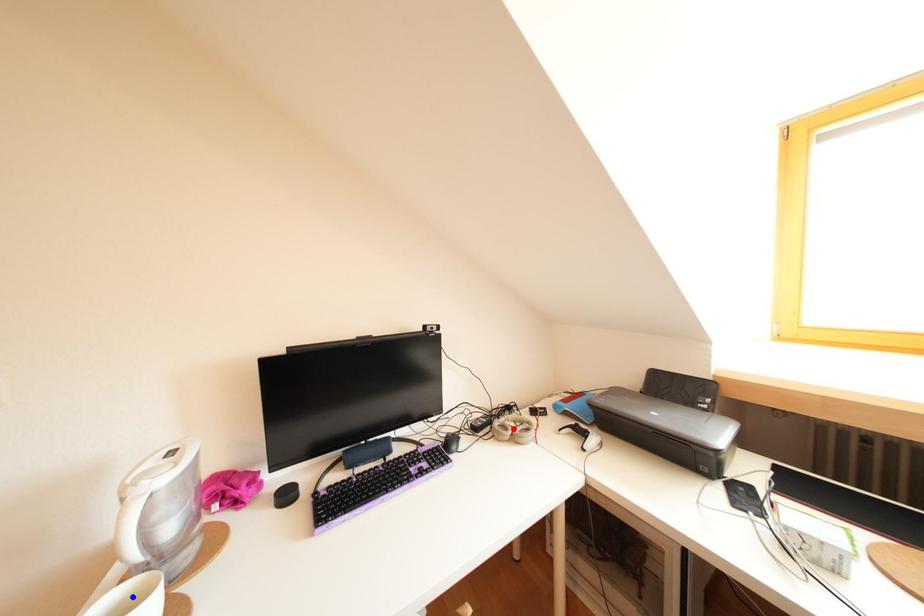
Question: Two points are marked on the image. Which point is closer to the camera?

Choices:
 (A) Blue point is closer.
 (B) Red point is closer.

Answer: (A)